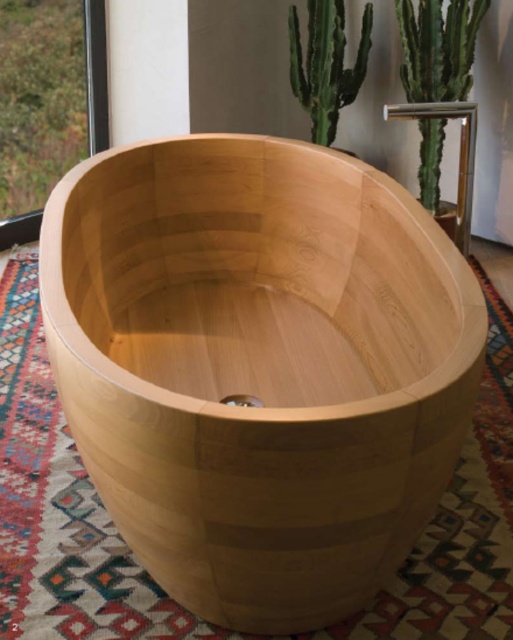
You are standing in the bathroom and see two points marked on the wall behind the wooden bathtub. Which point, point (417, 45) or point (365, 38), is closer to you?

Point (417, 45) is closer to the viewer than point (365, 38).

You are a delivery person who needs to place a 1.2 meter long package on the floor near the natural wood bathtub at center without moving the bathtub. Is there enough space between the bathtub and the wall to safely place the package?

The distance between the natural wood bathtub at center and the camera is 1.15 meters, but the space between the bathtub and the wall isn however, the package is 1.2 meters long. Since the available space is less than the package length, the package cannot be placed there without overlapping the bathtub or the wall.